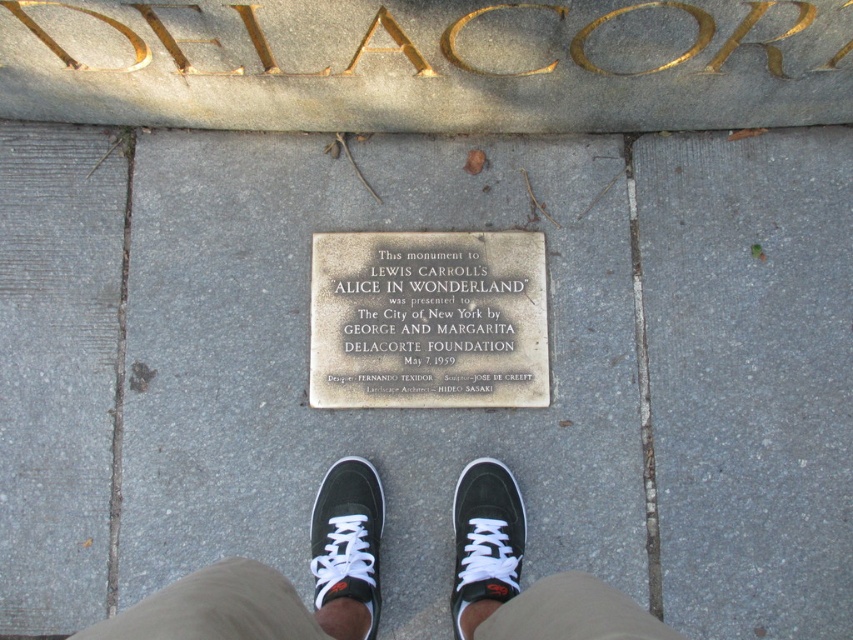
Question: Which point is closer to the camera?

Choices:
 (A) (492, 552)
 (B) (440, 356)
 (C) (460, 552)

Answer: (A)

Question: Which is nearer to the black suede sneaker at center?

Choices:
 (A) black matte sneaker at lower center
 (B) silver metallic plaque at center

Answer: (A)

Question: Does silver metallic plaque at center have a larger size compared to black suede sneaker at center?

Choices:
 (A) yes
 (B) no

Answer: (A)

Question: Does black fabric pants at lower center appear on the right side of silver metallic plaque at center?

Choices:
 (A) no
 (B) yes

Answer: (A)

Question: Is black fabric pants at lower center smaller than black matte sneaker at lower center?

Choices:
 (A) no
 (B) yes

Answer: (A)

Question: Which object is positioned closest to the black fabric pants at lower center?

Choices:
 (A) black matte sneaker at lower center
 (B) black suede sneaker at center
 (C) silver metallic plaque at center

Answer: (A)